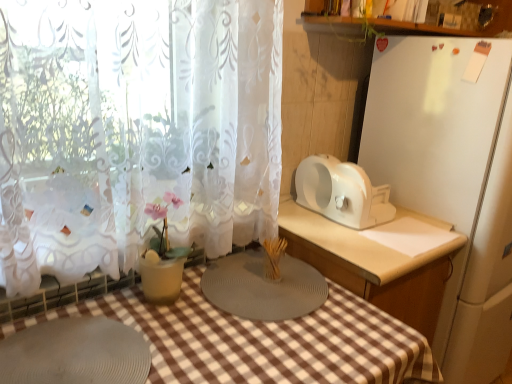
Locate an element on the screen. This screenshot has width=512, height=384. free space in front of white plastic toaster at right, the second appliance when ordered from right to left is located at coordinates (354, 240).